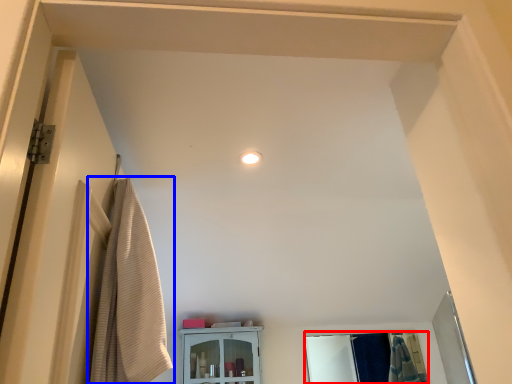
Question: Among these objects, which one is farthest to the camera, mirror (highlighted by a red box) or curtain (highlighted by a blue box)?

Choices:
 (A) mirror
 (B) curtain

Answer: (A)